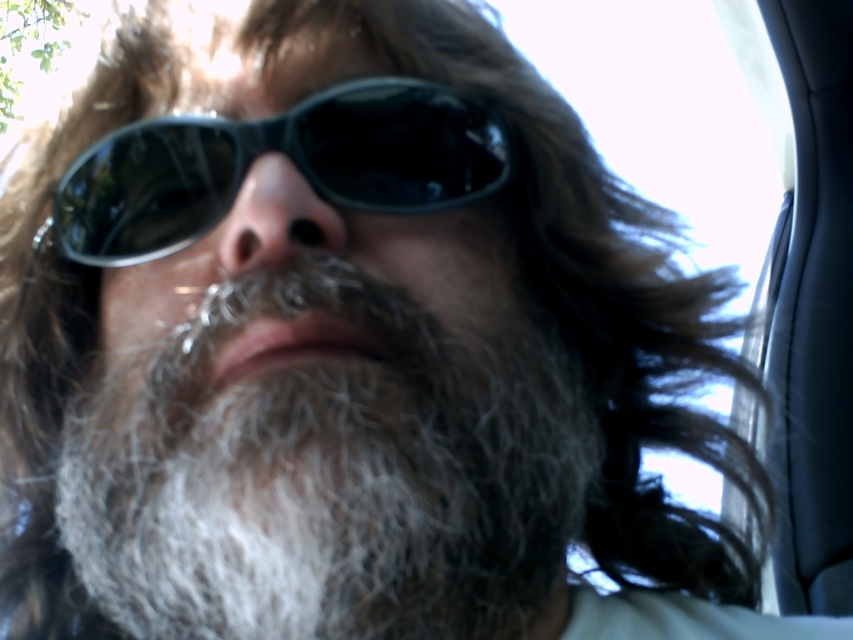
The height and width of the screenshot is (640, 853). What are the coordinates of `gray fuzzy beard at center` in the screenshot? It's located at (325, 468).

Looking at this image, does gray fuzzy beard at center have a greater width compared to black plastic sunglasses at center?

Indeed, gray fuzzy beard at center has a greater width compared to black plastic sunglasses at center.

This screenshot has height=640, width=853. Identify the location of gray fuzzy beard at center. (325, 468).